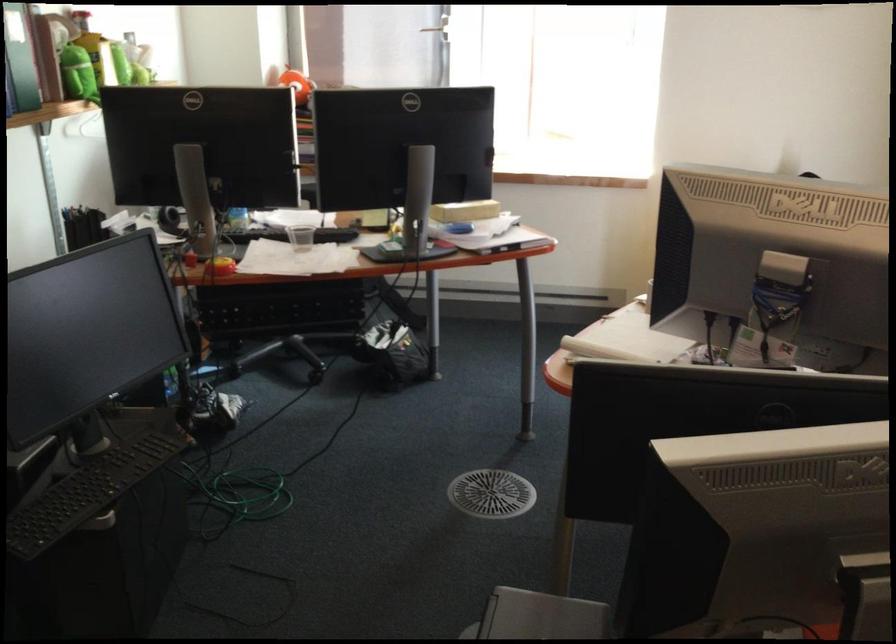
At what (x,y) coordinates should I click in order to perform the action: click on chair sitting surface. Please return your answer as a coordinate pair (x, y). This screenshot has width=896, height=644. Looking at the image, I should click on (294, 307).